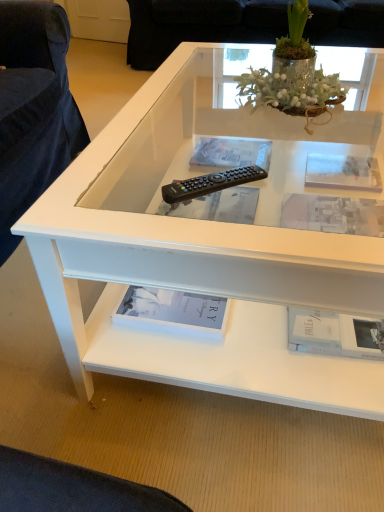
Question: Is white matte book at lower right, the 5th book when ordered from back to front, inside or outside of transparent glass frame at upper center?

Choices:
 (A) inside
 (B) outside

Answer: (B)

Question: Based on their positions, is white matte book at lower right, arranged as the 1th book when viewed from the front, located to the left or right of transparent glass frame at upper center?

Choices:
 (A) left
 (B) right

Answer: (A)

Question: Estimate the real-world distances between objects in this image. Which object is farther from the matte black remote control at center, which is the second book in back-to-front order?

Choices:
 (A) black plastic remote control at center
 (B) white paper book at lower center, the 4th book positioned from the back
 (C) clear plastic book at center, which is counted as the 5th book, starting from the front
 (D) transparent glass frame at upper center
 (E) white matte book at upper right, positioned as the third book in back-to-front order

Answer: (A)

Question: Which of these objects is positioned closest to the transparent glass frame at upper center?

Choices:
 (A) clear plastic book at center, which is counted as the 5th book, starting from the front
 (B) green glass vase at upper center
 (C) white matte book at upper right, acting as the 3th book starting from the front
 (D) white paper book at lower center, positioned as the second book in front-to-back order
 (E) black plastic remote control at center

Answer: (C)